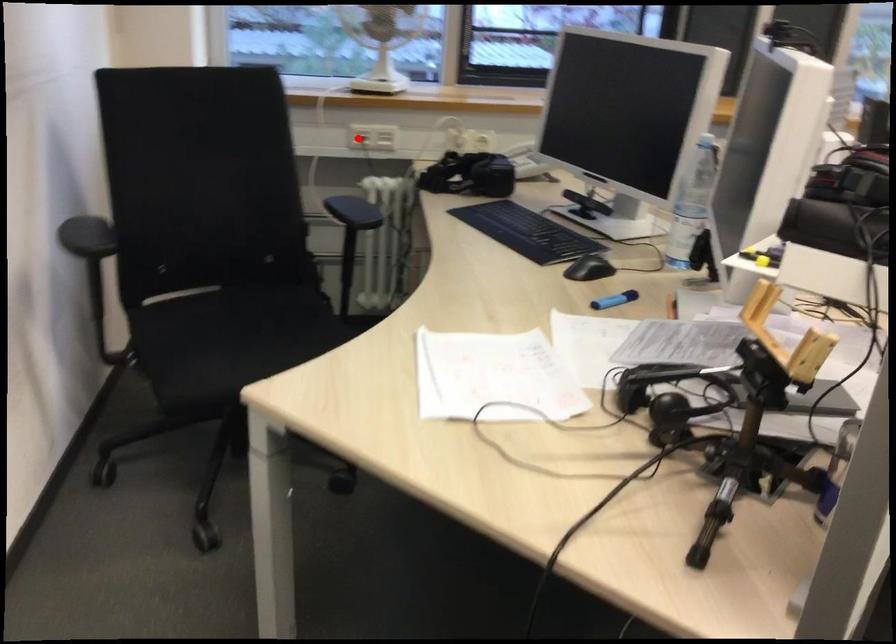
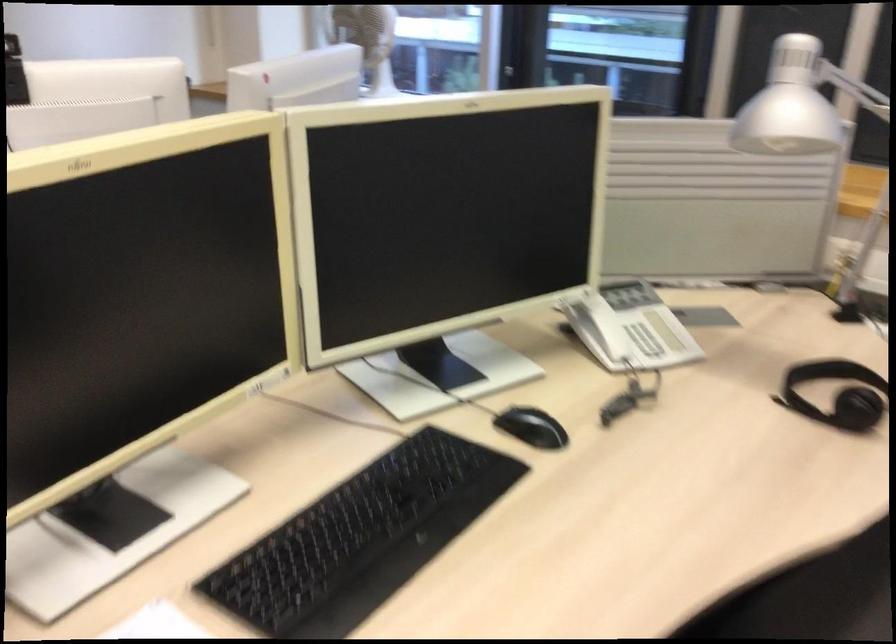
Question: I am providing you with two images of the same scene from different viewpoints. A red point is marked on the first image. Can you still see the location of the red point in image 2?

Choices:
 (A) Yes
 (B) No

Answer: (B)